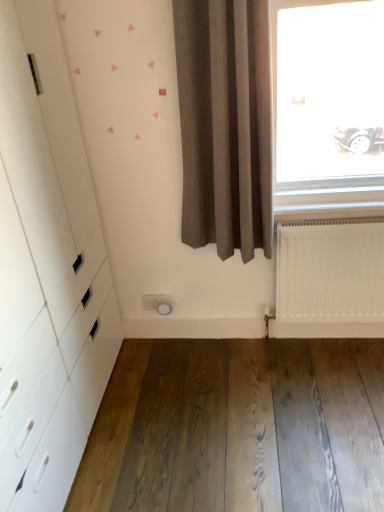
Question: Is white glossy dresser at left inside natural wood floor at lower center?

Choices:
 (A) no
 (B) yes

Answer: (A)

Question: From the image's perspective, is natural wood floor at lower center below white glossy dresser at left?

Choices:
 (A) no
 (B) yes

Answer: (B)

Question: Does natural wood floor at lower center have a greater width compared to white glossy dresser at left?

Choices:
 (A) no
 (B) yes

Answer: (B)

Question: Does natural wood floor at lower center come behind white glossy dresser at left?

Choices:
 (A) no
 (B) yes

Answer: (B)

Question: Can you confirm if natural wood floor at lower center is smaller than white glossy dresser at left?

Choices:
 (A) yes
 (B) no

Answer: (A)

Question: Considering the positions of white matte radiator at lower right and white glossy dresser at left in the image, is white matte radiator at lower right taller or shorter than white glossy dresser at left?

Choices:
 (A) short
 (B) tall

Answer: (A)

Question: Relative to white glossy dresser at left, is white matte radiator at lower right in front or behind?

Choices:
 (A) front
 (B) behind

Answer: (B)

Question: Considering the relative positions of white matte radiator at lower right and white glossy dresser at left in the image provided, is white matte radiator at lower right to the left or to the right of white glossy dresser at left?

Choices:
 (A) left
 (B) right

Answer: (B)

Question: Is point (299, 246) closer or farther from the camera than point (44, 258)?

Choices:
 (A) farther
 (B) closer

Answer: (A)

Question: Looking at the image, does white glossy dresser at left seem bigger or smaller compared to natural wood floor at lower center?

Choices:
 (A) big
 (B) small

Answer: (A)

Question: Considering the positions of white glossy dresser at left and natural wood floor at lower center in the image, is white glossy dresser at left taller or shorter than natural wood floor at lower center?

Choices:
 (A) short
 (B) tall

Answer: (B)

Question: From the image's perspective, is white glossy dresser at left positioned above or below natural wood floor at lower center?

Choices:
 (A) below
 (B) above

Answer: (B)

Question: Is white glossy dresser at left spatially inside natural wood floor at lower center, or outside of it?

Choices:
 (A) outside
 (B) inside

Answer: (A)

Question: Considering the positions of natural wood floor at lower center and white matte radiator at lower right in the image, is natural wood floor at lower center bigger or smaller than white matte radiator at lower right?

Choices:
 (A) big
 (B) small

Answer: (B)

Question: Considering the positions of natural wood floor at lower center and white matte radiator at lower right in the image, is natural wood floor at lower center taller or shorter than white matte radiator at lower right?

Choices:
 (A) short
 (B) tall

Answer: (A)